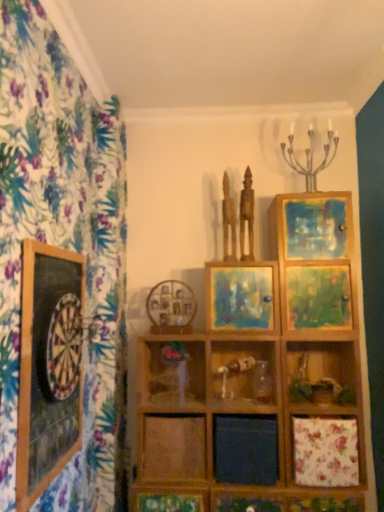
Question: From a real-world perspective, is wooden dartboard at left, which appears as the 3th picture frame when viewed from the right, below wooden picture frame at center, acting as the second picture frame starting from the left?

Choices:
 (A) no
 (B) yes

Answer: (B)

Question: Considering the relative sizes of wooden dartboard at left, arranged as the 1th picture frame when viewed from the left, and wooden picture frame at center, placed as the first picture frame when sorted from back to front, in the image provided, is wooden dartboard at left, arranged as the 1th picture frame when viewed from the left, smaller than wooden picture frame at center, placed as the first picture frame when sorted from back to front,?

Choices:
 (A) no
 (B) yes

Answer: (A)

Question: Does wooden dartboard at left, arranged as the first picture frame when viewed from the front, have a greater width compared to wooden picture frame at center, positioned as the second picture frame in right-to-left order?

Choices:
 (A) no
 (B) yes

Answer: (A)

Question: From a real-world perspective, is wooden dartboard at left, arranged as the first picture frame when viewed from the front, on top of wooden picture frame at center, positioned as the second picture frame in right-to-left order?

Choices:
 (A) yes
 (B) no

Answer: (B)

Question: Is wooden picture frame at center, acting as the second picture frame starting from the left, inside wooden dartboard at left, arranged as the first picture frame when viewed from the front?

Choices:
 (A) no
 (B) yes

Answer: (A)

Question: From a real-world perspective, relative to wooden picture frame at center, placed as the first picture frame when sorted from back to front, is wooden shelf at center vertically above or below?

Choices:
 (A) above
 (B) below

Answer: (B)

Question: From their relative heights in the image, would you say wooden shelf at center is taller or shorter than wooden picture frame at center, acting as the second picture frame starting from the left?

Choices:
 (A) short
 (B) tall

Answer: (B)

Question: Is wooden shelf at center wider or thinner than wooden picture frame at center, acting as the second picture frame starting from the left?

Choices:
 (A) wide
 (B) thin

Answer: (A)

Question: From the image's perspective, is wooden shelf at center above or below wooden picture frame at center, placed as the first picture frame when sorted from back to front?

Choices:
 (A) above
 (B) below

Answer: (B)

Question: Would you say matte wooden picture frame at center, the second picture frame in the front-to-back sequence, is to the left or to the right of wooden statue at center, marked as the second sculpture in a right-to-left arrangement, in the picture?

Choices:
 (A) left
 (B) right

Answer: (B)

Question: Is matte wooden picture frame at center, the second picture frame in the front-to-back sequence, wider or thinner than wooden statue at center, which is the 1th sculpture in left-to-right order?

Choices:
 (A) wide
 (B) thin

Answer: (A)

Question: Is point (215, 322) positioned closer to the camera than point (226, 219)?

Choices:
 (A) closer
 (B) farther

Answer: (A)

Question: Which is correct: matte wooden picture frame at center, the second picture frame in the front-to-back sequence, is inside wooden statue at center, which is the 1th sculpture in left-to-right order, or outside of it?

Choices:
 (A) inside
 (B) outside

Answer: (B)

Question: Which is correct: wooden statue at center, which is the 1th sculpture in left-to-right order, is inside matte wooden picture frame at center, arranged as the 1th picture frame when viewed from the right, or outside of it?

Choices:
 (A) outside
 (B) inside

Answer: (A)

Question: In terms of size, does wooden statue at center, which is the 1th sculpture in left-to-right order, appear bigger or smaller than matte wooden picture frame at center, the 2th picture frame in the back-to-front sequence?

Choices:
 (A) small
 (B) big

Answer: (A)